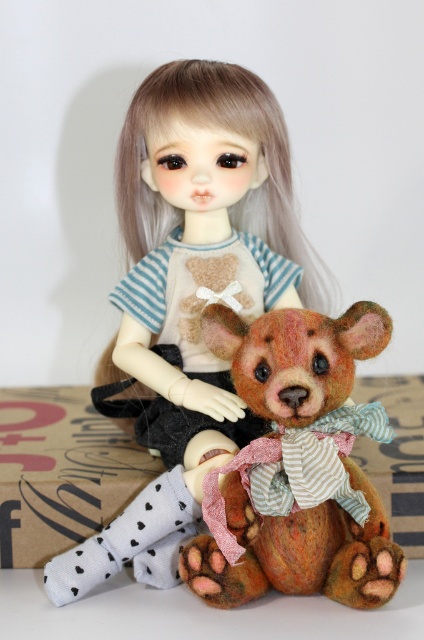
You are a photographer trying to capture a closeup of the textured brown bear at center. However, the matte beige doll at center is blocking your view. Can you move the doll to get a clear shot of the bear?

The matte beige doll at center is closer to the viewer than the textured brown bear at center, so moving the doll would allow you to see the bear clearly.

You are standing in a room and want to place a 40 inch long decorative mat between you and the matte beige doll at center. Can you fit the mat without it overlapping the doll?

The distance between you and the matte beige doll at center is 38.64 inches, which is shorter than the 40 inch mat. Therefore, the mat cannot be placed without overlapping the doll.

In the scene shown: You are a toy collector who wants to place both the matte beige doll at center and the textured brown bear at center on a shelf. The shelf has a maximum length of 30 centimeters. Can both items fit side by side on the shelf without overlapping?

The matte beige doll at center is 16.39 centimeters from the textured brown bear at center. Since the total distance between them is less than 30 centimeters, both items can fit side by side on the shelf without overlapping.